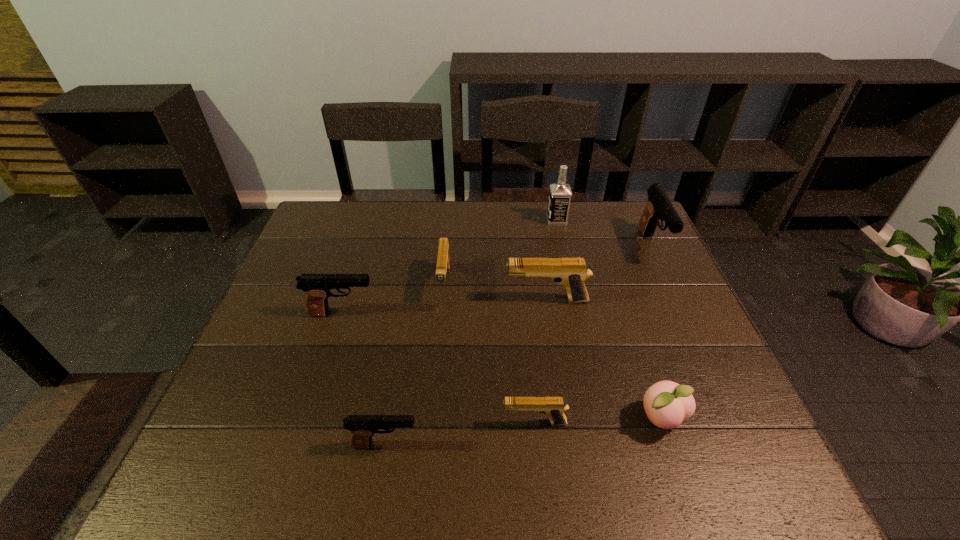
This screenshot has height=540, width=960. What are the coordinates of `object that can be found as the second closest to the rightmost object` in the screenshot? It's located at (570, 272).

You are a GUI agent. You are given a task and a screenshot of the screen. Output one action in this format:
    pyautogui.click(x=<x>, y=<y>)
    Task: Click on the object that stands as the fourth closest to the vodka
    
    Given the screenshot: What is the action you would take?
    pyautogui.click(x=317, y=287)

Locate an element on the screen. The image size is (960, 540). pistol that stands as the sixth closest to the vodka is located at coordinates click(363, 427).

Locate an element on the screen. The height and width of the screenshot is (540, 960). pistol that is the second closest to the pink peach is located at coordinates (570, 272).

Point out which black pistol is positioned as the second nearest to the second black pistol from right to left. Please provide its 2D coordinates. Your answer should be formatted as a tuple, i.e. [(x, y)], where the tuple contains the x and y coordinates of a point satisfying the conditions above.

[(659, 206)]

Where is `black pistol object that ranks as the closest to the rightmost pistol`? black pistol object that ranks as the closest to the rightmost pistol is located at coordinates (317, 287).

Select which tan pistol is the third closest to the rightmost pistol. Please provide its 2D coordinates. Your answer should be formatted as a tuple, i.e. [(x, y)], where the tuple contains the x and y coordinates of a point satisfying the conditions above.

[(443, 260)]

This screenshot has height=540, width=960. I want to click on tan pistol that stands as the closest to the second black pistol from right to left, so click(554, 407).

Image resolution: width=960 pixels, height=540 pixels. I want to click on vacant point that satisfies the following two spatial constraints: 1. on the front label of the vodka; 2. on the back side of the pink peach, so click(x=601, y=420).

Locate an element on the screen. The width and height of the screenshot is (960, 540). blank area in the image that satisfies the following two spatial constraints: 1. at the barrel of the fourth pistol from right to left; 2. at the barrel of the smallest black pistol is located at coordinates (430, 445).